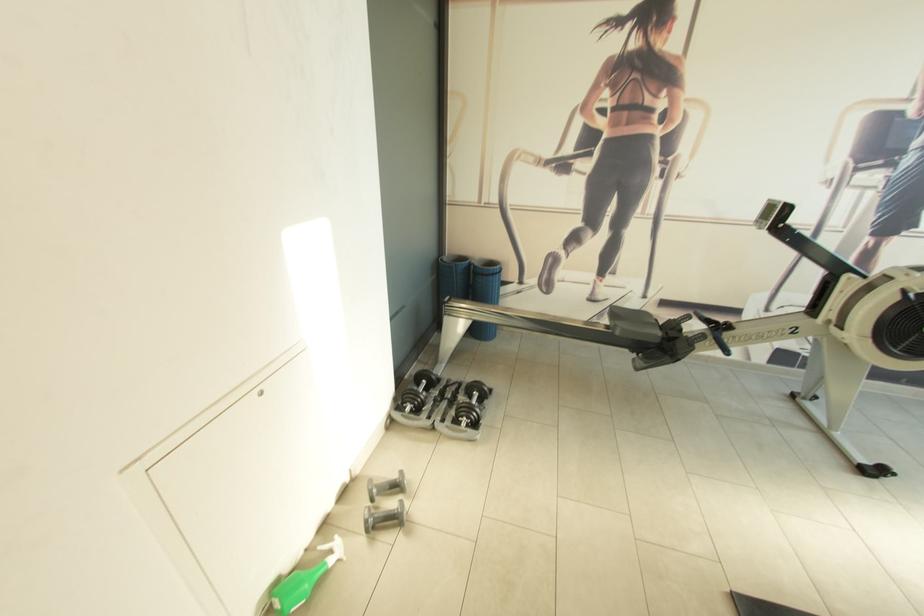
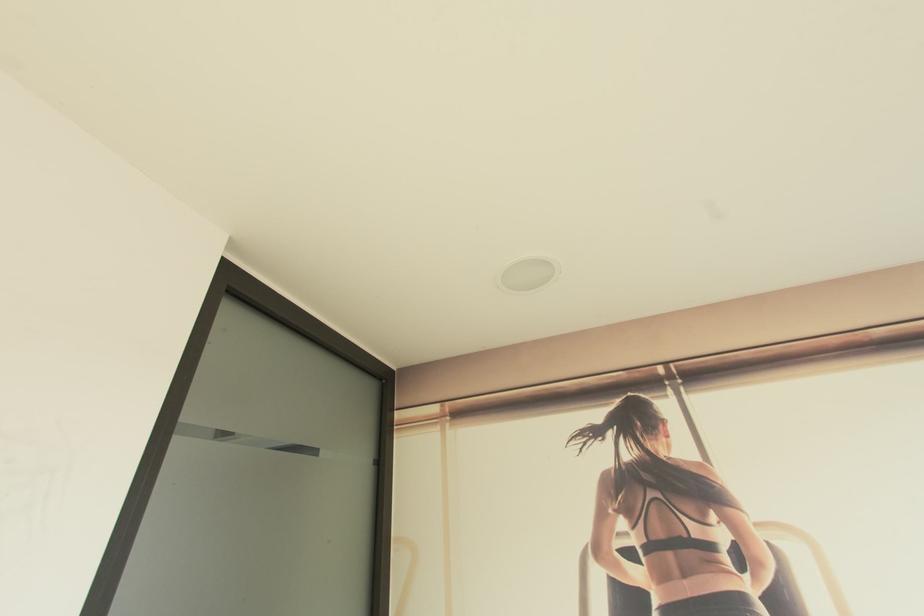
Question: Based on the continuous images, in which direction is the camera rotating? Reply with the corresponding letter.

Choices:
 (A) Left
 (B) Right
 (C) Up
 (D) Down

Answer: (C)